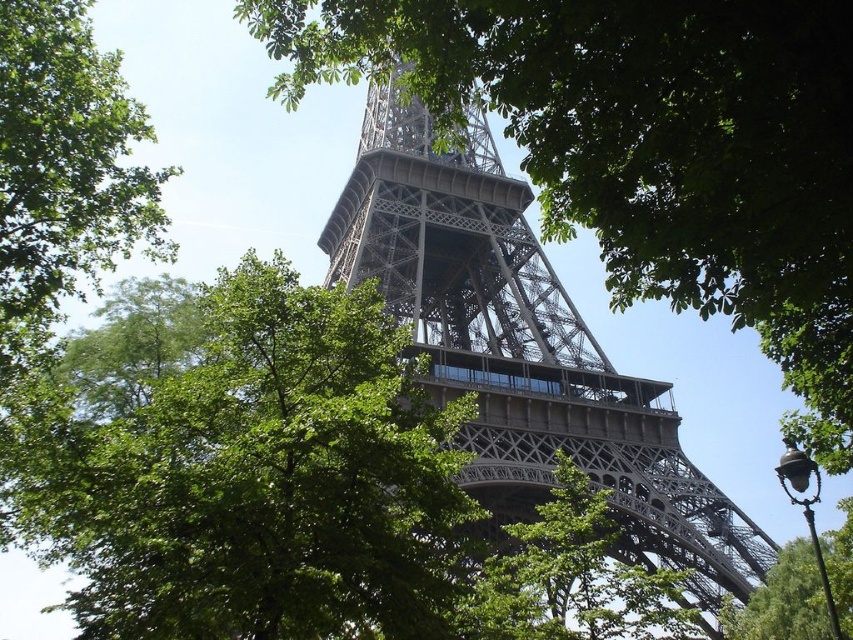
Measure the distance between point (x=518, y=458) and camera.

Point (x=518, y=458) and camera are 239.30 feet apart from each other.

Who is positioned more to the right, metallic gray tower at center or green leafy tree at lower right?

green leafy tree at lower right is more to the right.

Which is behind, point (358, 147) or point (791, 566)?

Point (358, 147)

Find the location of a particular element. The height and width of the screenshot is (640, 853). metallic gray tower at center is located at coordinates (523, 348).

Is green leafy tree at center taller than green leafy tree at lower right?

Indeed, green leafy tree at center has a greater height compared to green leafy tree at lower right.

Can you confirm if green leafy tree at center is bigger than green leafy tree at lower right?

Yes.

In order to click on green leafy tree at center in this screenshot , I will do `click(258, 480)`.

At what (x,y) coordinates should I click in order to perform the action: click on green leafy tree at center. Please return your answer as a coordinate pair (x, y). Looking at the image, I should click on (258, 480).

Does green leafy tree at center appear on the left side of metallic gray tower at center?

Indeed, green leafy tree at center is positioned on the left side of metallic gray tower at center.

Which is above, green leafy tree at center or metallic gray tower at center?

metallic gray tower at center

The image size is (853, 640). I want to click on green leafy tree at center, so click(258, 480).

Where is `green leafy tree at center`? The width and height of the screenshot is (853, 640). green leafy tree at center is located at coordinates (258, 480).